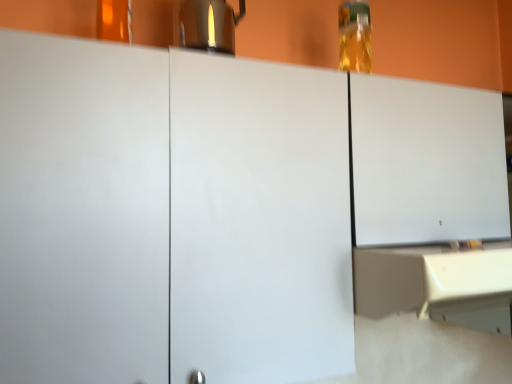
Describe the element at coordinates (354, 36) in the screenshot. I see `translucent glass bottle at upper right` at that location.

Locate an element on the screen. The width and height of the screenshot is (512, 384). satin silver coffee pot at upper center is located at coordinates (208, 25).

Can you confirm if beige matte counter at lower right is wider than satin silver coffee pot at upper center?

Yes.

Locate an element on the screen. This screenshot has height=384, width=512. counter located in front of the satin silver coffee pot at upper center is located at coordinates (437, 284).

From a real-world perspective, is beige matte counter at lower right positioned over satin silver coffee pot at upper center based on gravity?

No, from a real-world perspective, beige matte counter at lower right is not above satin silver coffee pot at upper center.

Which of these two, translucent glass bottle at upper right or beige matte counter at lower right, is wider?

Wider between the two is beige matte counter at lower right.

Is translucent glass bottle at upper right not inside beige matte counter at lower right?

Yes, translucent glass bottle at upper right is outside of beige matte counter at lower right.

Considering the relative positions of translucent glass bottle at upper right and beige matte counter at lower right in the image provided, is translucent glass bottle at upper right to the left or to the right of beige matte counter at lower right?

translucent glass bottle at upper right is positioned on beige matte counter at lower right's left side.

From the picture: Is translucent glass bottle at upper right bigger than beige matte counter at lower right?

No.

How distant is satin silver coffee pot at upper center from beige matte counter at lower right?

satin silver coffee pot at upper center is 36.80 inches from beige matte counter at lower right.

Is beige matte counter at lower right a part of satin silver coffee pot at upper center?

That's incorrect, beige matte counter at lower right is not inside satin silver coffee pot at upper center.

Locate an element on the screen. The image size is (512, 384). counter below the satin silver coffee pot at upper center (from the image's perspective) is located at coordinates (437, 284).

Is beige matte counter at lower right aimed at translucent glass bottle at upper right?

No, beige matte counter at lower right is not turned towards translucent glass bottle at upper right.

The width and height of the screenshot is (512, 384). I want to click on bottle behind the beige matte counter at lower right, so click(354, 36).

From the image's perspective, is beige matte counter at lower right on translucent glass bottle at upper right?

No, from the image's perspective, beige matte counter at lower right is not on top of translucent glass bottle at upper right.

Is there a large distance between beige matte counter at lower right and translucent glass bottle at upper right?

No, beige matte counter at lower right is not far away from translucent glass bottle at upper right.

Based on the photo, from a real-world perspective, which object stands above the other?

In real-world perspective, translucent glass bottle at upper right is above.

The height and width of the screenshot is (384, 512). In order to click on bottle above the satin silver coffee pot at upper center (from the image's perspective) in this screenshot , I will do `click(354, 36)`.

Does satin silver coffee pot at upper center turn towards translucent glass bottle at upper right?

No, satin silver coffee pot at upper center is not turned towards translucent glass bottle at upper right.

Who is smaller, translucent glass bottle at upper right or satin silver coffee pot at upper center?

With smaller size is translucent glass bottle at upper right.

From the image's perspective, relative to satin silver coffee pot at upper center, is translucent glass bottle at upper right above or below?

Based on their image positions, translucent glass bottle at upper right is located above satin silver coffee pot at upper center.

Considering the positions of objects translucent glass bottle at upper right and satin silver coffee pot at upper center in the image provided, who is more to the right, translucent glass bottle at upper right or satin silver coffee pot at upper center?

Positioned to the right is translucent glass bottle at upper right.

Identify the location of counter in front of the satin silver coffee pot at upper center. The height and width of the screenshot is (384, 512). (437, 284).

This screenshot has width=512, height=384. In the image, there is a translucent glass bottle at upper right. Identify the location of counter below it (from the image's perspective). (437, 284).

Considering their positions, is beige matte counter at lower right positioned further to translucent glass bottle at upper right than satin silver coffee pot at upper center?

beige matte counter at lower right lies further to translucent glass bottle at upper right than the other object.

Considering their positions, is translucent glass bottle at upper right positioned closer to beige matte counter at lower right than satin silver coffee pot at upper center?

translucent glass bottle at upper right lies closer to beige matte counter at lower right than the other object.

Based on their spatial positions, is satin silver coffee pot at upper center or beige matte counter at lower right further from translucent glass bottle at upper right?

The object further to translucent glass bottle at upper right is beige matte counter at lower right.

Considering their positions, is beige matte counter at lower right positioned further to satin silver coffee pot at upper center than translucent glass bottle at upper right?

beige matte counter at lower right is positioned further to the anchor satin silver coffee pot at upper center.

Considering their positions, is translucent glass bottle at upper right positioned closer to satin silver coffee pot at upper center than beige matte counter at lower right?

translucent glass bottle at upper right is positioned closer to the anchor satin silver coffee pot at upper center.

Consider the image. Based on their spatial positions, is satin silver coffee pot at upper center or translucent glass bottle at upper right closer to beige matte counter at lower right?

translucent glass bottle at upper right.

Find the location of `coffeepot that lies between translucent glass bottle at upper right and beige matte counter at lower right from top to bottom`. coffeepot that lies between translucent glass bottle at upper right and beige matte counter at lower right from top to bottom is located at coordinates (208, 25).